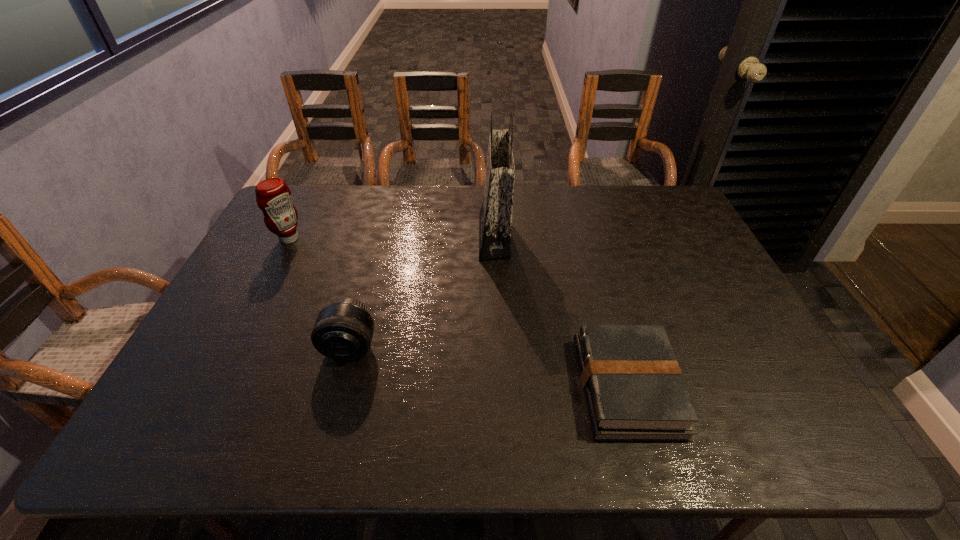
Locate an element on the screen. This screenshot has width=960, height=540. shopping bag is located at coordinates (495, 218).

At what (x,y) coordinates should I click in order to perform the action: click on the tallest object. Please return your answer as a coordinate pair (x, y). This screenshot has height=540, width=960. Looking at the image, I should click on tap(495, 218).

At what (x,y) coordinates should I click in order to perform the action: click on condiment. Please return your answer as a coordinate pair (x, y). The image size is (960, 540). Looking at the image, I should click on (273, 196).

Image resolution: width=960 pixels, height=540 pixels. What are the coordinates of `the second tallest object` in the screenshot? It's located at (273, 196).

This screenshot has height=540, width=960. I want to click on telephoto lens, so click(x=343, y=331).

Where is `the second object from left to right`? the second object from left to right is located at coordinates (343, 331).

Identify the location of the shortest object. This screenshot has height=540, width=960. click(x=634, y=390).

The image size is (960, 540). What are the coordinates of `the rightmost object` in the screenshot? It's located at [x=634, y=390].

At what (x,y) coordinates should I click in order to perform the action: click on free spot located on the front of the shopping bag with the design. Please return your answer as a coordinate pair (x, y). The height and width of the screenshot is (540, 960). Looking at the image, I should click on (396, 236).

This screenshot has height=540, width=960. I want to click on vacant region located on the front of the shopping bag with the design, so click(359, 236).